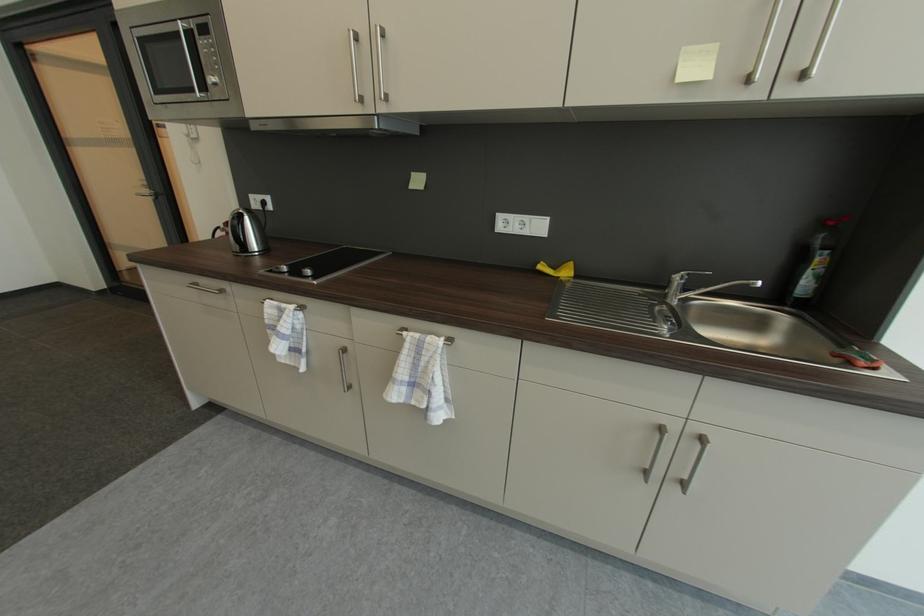
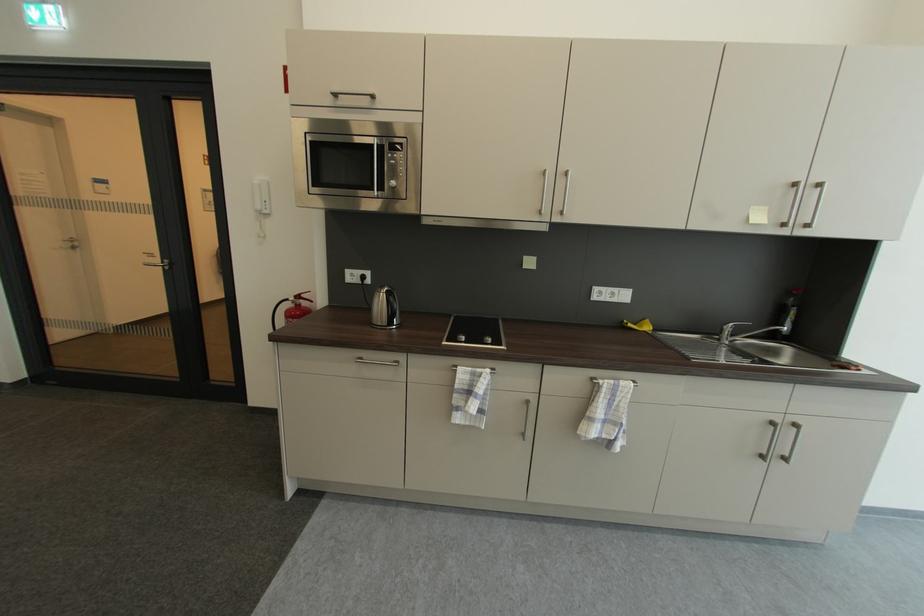
Find the pixel in the second image that matches (x=200, y=91) in the first image.

(380, 191)